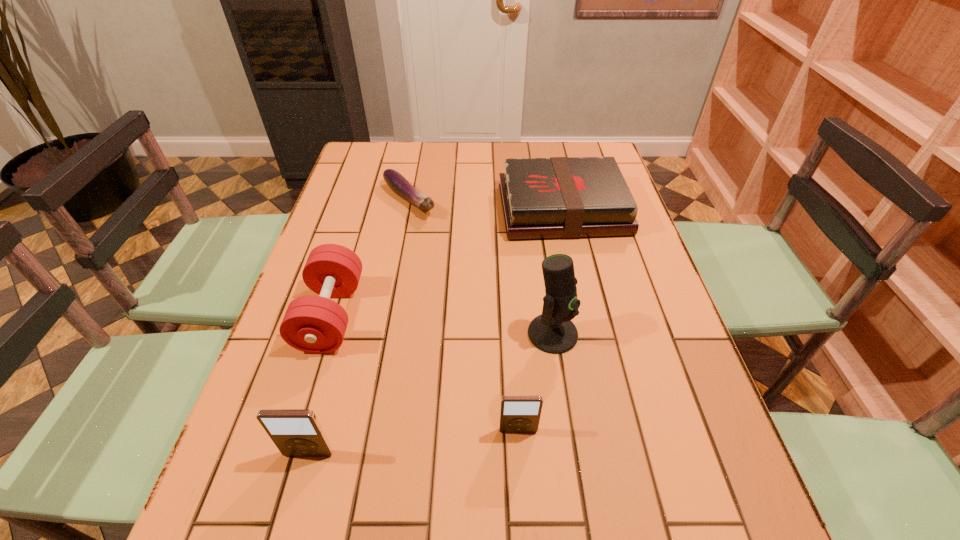
You are a GUI agent. You are given a task and a screenshot of the screen. Output one action in this format:
    pyautogui.click(x=<x>, y=<y>)
    Task: Click on the vacant space that's between the microphone and the taller iPod
    
    Given the screenshot: What is the action you would take?
    pyautogui.click(x=431, y=394)

What are the coordinates of `empty space between the tallest object and the dumbbell` in the screenshot? It's located at (442, 325).

This screenshot has height=540, width=960. What are the coordinates of `vacant area that lies between the hardback book and the dumbbell` in the screenshot? It's located at (446, 262).

This screenshot has width=960, height=540. In order to click on unoccupied area between the farther iPod and the dumbbell in this screenshot , I will do tap(424, 373).

Select which object is the closest to the left iPod. Please provide its 2D coordinates. Your answer should be formatted as a tuple, i.e. [(x, y)], where the tuple contains the x and y coordinates of a point satisfying the conditions above.

[(313, 324)]

At what (x,y) coordinates should I click in order to perform the action: click on the closest object relative to the eggplant. Please return your answer as a coordinate pair (x, y). The image size is (960, 540). Looking at the image, I should click on (558, 197).